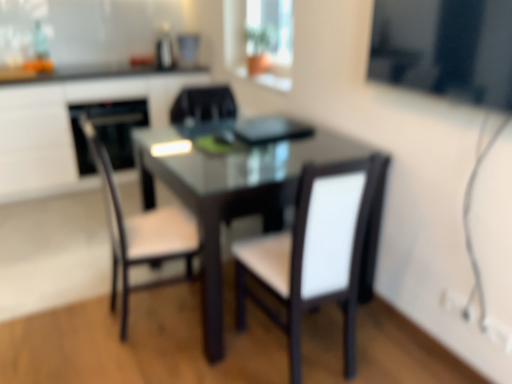
Question: Is black glossy oven at left turned away from black matte chair at center, which appears as the second chair when viewed from the right?

Choices:
 (A) no
 (B) yes

Answer: (A)

Question: From a real-world perspective, is black glossy oven at left on top of black matte chair at center, the second chair in the left-to-right sequence?

Choices:
 (A) no
 (B) yes

Answer: (A)

Question: Considering the relative positions of black glossy oven at left and black matte chair at center, which appears as the second chair when viewed from the right, in the image provided, is black glossy oven at left to the right of black matte chair at center, which appears as the second chair when viewed from the right, from the viewer's perspective?

Choices:
 (A) yes
 (B) no

Answer: (B)

Question: Does black glossy oven at left appear on the left side of black matte chair at center, the second chair in the left-to-right sequence?

Choices:
 (A) no
 (B) yes

Answer: (B)

Question: Does black glossy oven at left have a larger size compared to black matte chair at center, which appears as the second chair when viewed from the right?

Choices:
 (A) yes
 (B) no

Answer: (A)

Question: Is black glossy oven at left behind black matte chair at center, the second chair in the left-to-right sequence?

Choices:
 (A) yes
 (B) no

Answer: (A)

Question: From the image's perspective, is black matte chair at center, which appears as the second chair when viewed from the right, over matte glass window at upper center, which appears as the second window screen when ordered from the bottom?

Choices:
 (A) no
 (B) yes

Answer: (A)

Question: From a real-world perspective, is black matte chair at center, the second chair in the left-to-right sequence, below matte glass window at upper center, arranged as the 1th window screen when viewed from the top?

Choices:
 (A) yes
 (B) no

Answer: (A)

Question: Does black matte chair at center, which appears as the second chair when viewed from the right, have a lesser width compared to matte glass window at upper center, which ranks as the 1th window screen in left-to-right order?

Choices:
 (A) yes
 (B) no

Answer: (B)

Question: Is matte glass window at upper center, arranged as the 1th window screen when viewed from the top, located within black matte chair at center, the second chair in the left-to-right sequence?

Choices:
 (A) no
 (B) yes

Answer: (A)

Question: From the image's perspective, is black matte chair at center, the second chair in the left-to-right sequence, under matte glass window at upper center, which is counted as the 1th window screen, starting from the back?

Choices:
 (A) yes
 (B) no

Answer: (A)

Question: Is the depth of black matte chair at center, the second chair in the left-to-right sequence, greater than that of matte glass window at upper center, which is counted as the 1th window screen, starting from the back?

Choices:
 (A) yes
 (B) no

Answer: (B)

Question: Would you say matte black desk at center is part of white leather chair at center, the first chair from the right,'s contents?

Choices:
 (A) no
 (B) yes

Answer: (A)